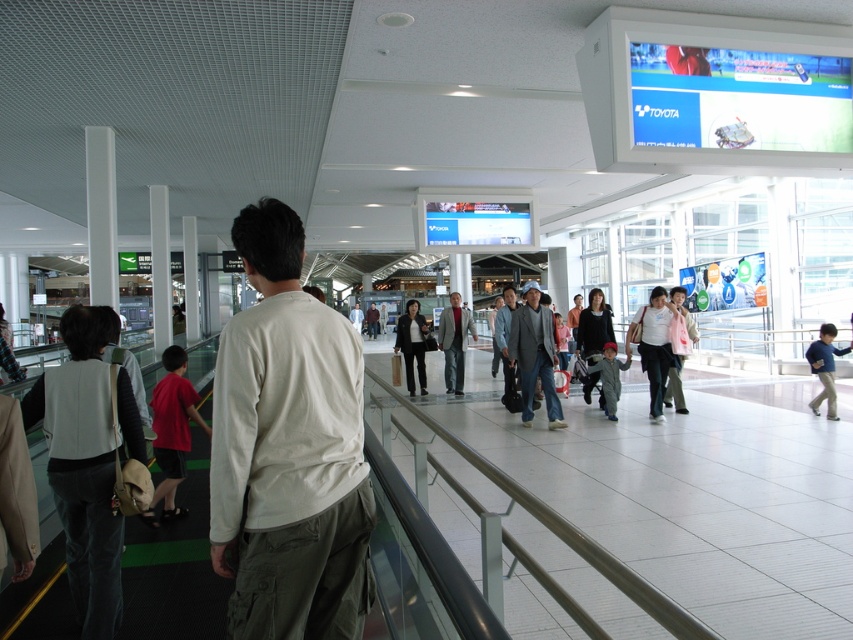
Question: Among these points, which one is nearest to the camera?

Choices:
 (A) (648, 316)
 (B) (598, 374)

Answer: (A)

Question: Does white cotton shirt at center appear over denim jacket at center?

Choices:
 (A) yes
 (B) no

Answer: (B)

Question: Does white matte shirt at center come in front of blue cotton shirt at right?

Choices:
 (A) yes
 (B) no

Answer: (A)

Question: Among these objects, which one is nearest to the camera?

Choices:
 (A) white cotton shirt at center
 (B) light brown leather jacket at center
 (C) red fabric child at center

Answer: (A)

Question: Is white cotton shirt at center to the right of matte pink jacket at center from the viewer's perspective?

Choices:
 (A) yes
 (B) no

Answer: (B)

Question: Estimate the real-world distances between objects in this image. Which object is farther from the white matte shirt at center?

Choices:
 (A) gray fabric jacket at center
 (B) red fabric child at center
 (C) denim jacket at center
 (D) light brown leather jacket at center

Answer: (C)